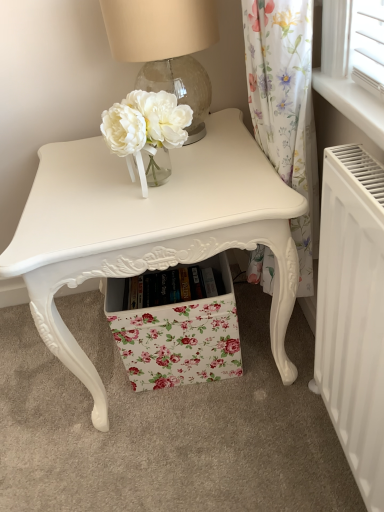
The width and height of the screenshot is (384, 512). In order to click on free space in front of matte white table at center in this screenshot , I will do point(200,457).